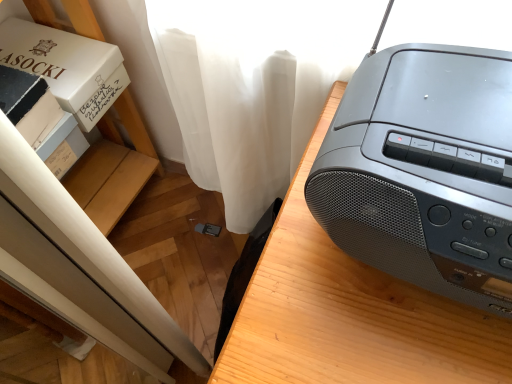
Question: Does white cardboard box at upper left appear on the left side of white cardboard box at upper left?

Choices:
 (A) yes
 (B) no

Answer: (B)

Question: Is white cardboard box at upper left completely or partially outside of white cardboard box at upper left?

Choices:
 (A) yes
 (B) no

Answer: (B)

Question: Does white cardboard box at upper left appear on the right side of white cardboard box at upper left?

Choices:
 (A) yes
 (B) no

Answer: (A)

Question: Is white cardboard box at upper left oriented towards white cardboard box at upper left?

Choices:
 (A) no
 (B) yes

Answer: (B)

Question: From a real-world perspective, is white cardboard box at upper left physically above white cardboard box at upper left?

Choices:
 (A) yes
 (B) no

Answer: (A)

Question: From a real-world perspective, is matte black boombox at right above or below white cardboard box at left?

Choices:
 (A) above
 (B) below

Answer: (B)

Question: Is matte black boombox at right bigger or smaller than white cardboard box at left?

Choices:
 (A) small
 (B) big

Answer: (B)

Question: Considering the positions of matte black boombox at right and white cardboard box at left in the image, is matte black boombox at right taller or shorter than white cardboard box at left?

Choices:
 (A) short
 (B) tall

Answer: (B)

Question: Is matte black boombox at right wider or thinner than white cardboard box at left?

Choices:
 (A) wide
 (B) thin

Answer: (A)

Question: Considering the positions of point (98, 180) and point (393, 114), is point (98, 180) closer or farther from the camera than point (393, 114)?

Choices:
 (A) closer
 (B) farther

Answer: (B)

Question: Is white cardboard box at upper left inside or outside of matte black radio at upper right?

Choices:
 (A) outside
 (B) inside

Answer: (A)

Question: In terms of width, does white cardboard box at upper left look wider or thinner when compared to matte black radio at upper right?

Choices:
 (A) thin
 (B) wide

Answer: (B)

Question: Is white cardboard box at upper left taller or shorter than matte black radio at upper right?

Choices:
 (A) short
 (B) tall

Answer: (B)

Question: Is matte black radio at upper right to the left or to the right of matte black boombox at right in the image?

Choices:
 (A) right
 (B) left

Answer: (B)

Question: Looking at their shapes, would you say matte black radio at upper right is wider or thinner than matte black boombox at right?

Choices:
 (A) wide
 (B) thin

Answer: (B)